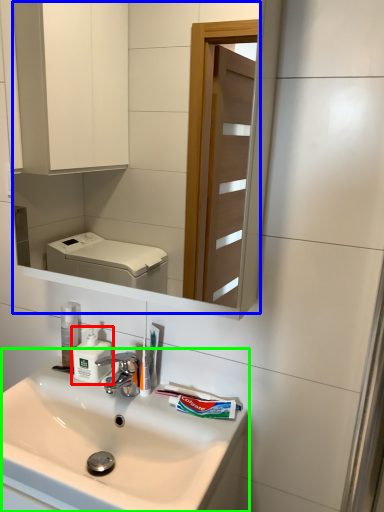
Question: Based on their relative distances, which object is farther from soap dispenser (highlighted by a red box)? Choose from mirror (highlighted by a blue box) and sink (highlighted by a green box).

Choices:
 (A) mirror
 (B) sink

Answer: (A)